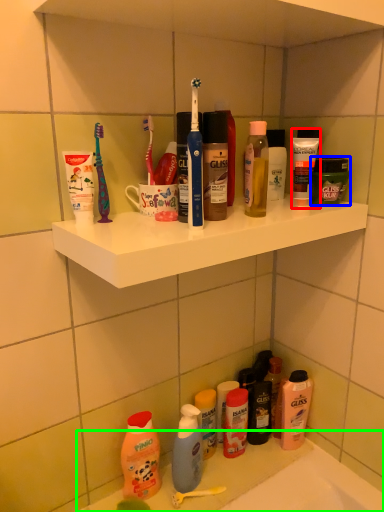
Question: Which object is positioned farthest from toiletry (highlighted by a red box)? Select from toiletry (highlighted by a blue box) and counter (highlighted by a green box).

Choices:
 (A) toiletry
 (B) counter

Answer: (B)